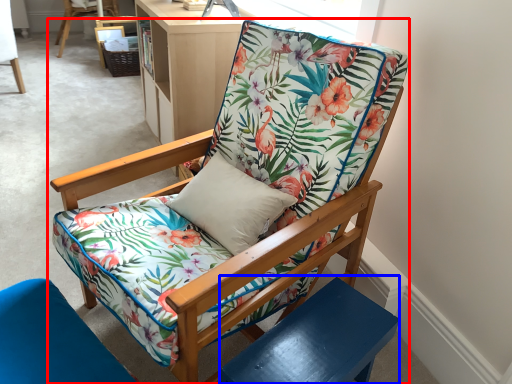
Question: Among these objects, which one is farthest to the camera, chair (highlighted by a red box) or side table (highlighted by a blue box)?

Choices:
 (A) chair
 (B) side table

Answer: (B)